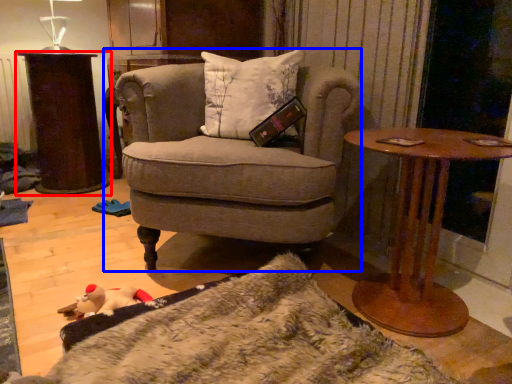
Question: Among these objects, which one is farthest to the camera, table (highlighted by a red box) or chair (highlighted by a blue box)?

Choices:
 (A) table
 (B) chair

Answer: (A)